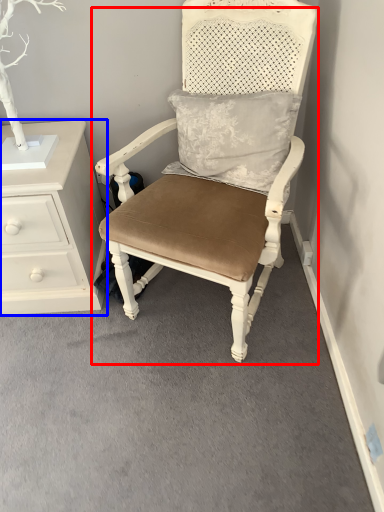
Question: Which object is further to the camera taking this photo, chair (highlighted by a red box) or chest of drawers (highlighted by a blue box)?

Choices:
 (A) chair
 (B) chest of drawers

Answer: (B)